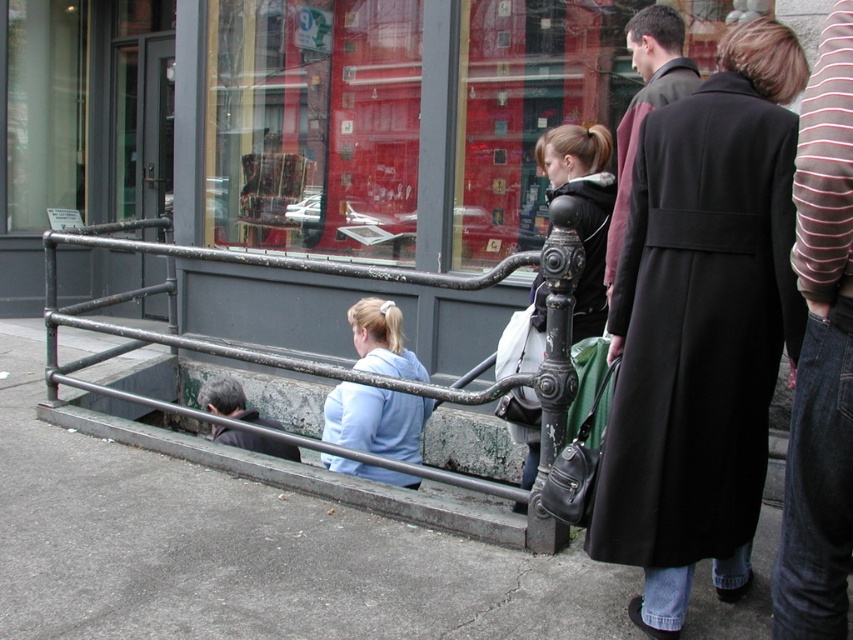
Question: Is dark brown coat at right to the right of dark gray fabric jacket at lower left from the viewer's perspective?

Choices:
 (A) no
 (B) yes

Answer: (B)

Question: Which object is the closest to the red glass window at center?

Choices:
 (A) matte black jacket at center
 (B) striped sweater at right

Answer: (A)

Question: Does black wool coat at right have a smaller size compared to dark brown coat at right?

Choices:
 (A) no
 (B) yes

Answer: (A)

Question: Which point appears farthest from the camera in this image?

Choices:
 (A) (810, 337)
 (B) (605, 292)
 (C) (576, 289)

Answer: (B)

Question: Does gray concrete pavement at lower left have a larger size compared to dark gray fabric jacket at lower left?

Choices:
 (A) yes
 (B) no

Answer: (A)

Question: Among these points, which one is nearest to the camera?

Choices:
 (A) (750, 116)
 (B) (663, 40)

Answer: (A)